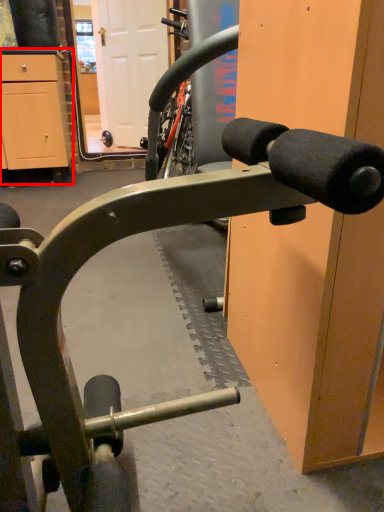
Question: Observing the image, what is the correct spatial positioning of cabinetry (annotated by the red box) in reference to door?

Choices:
 (A) left
 (B) right

Answer: (A)